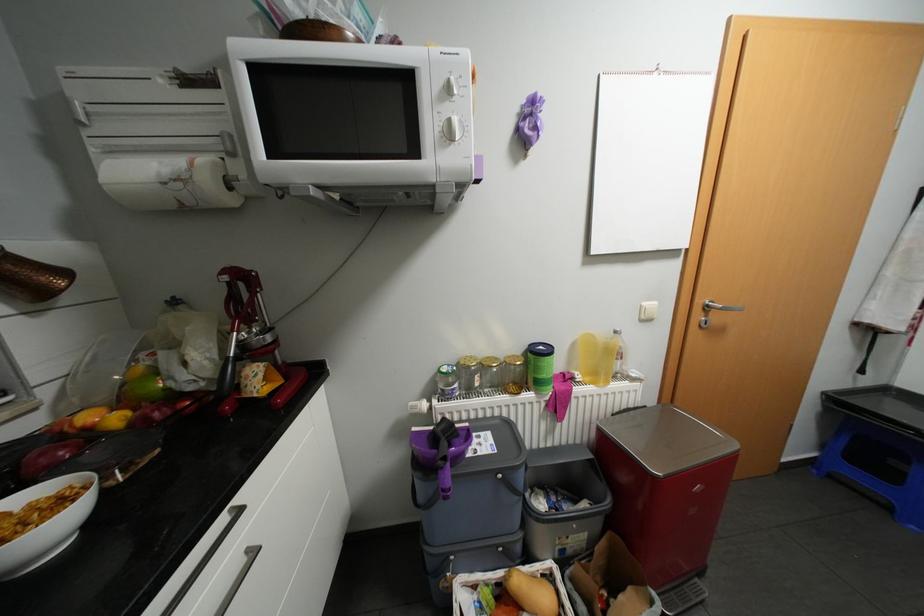
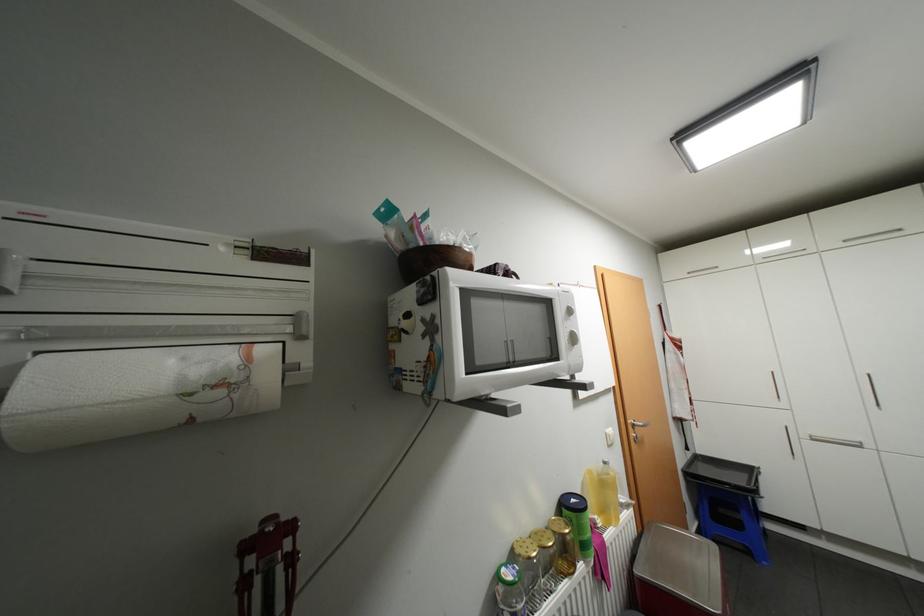
Find the pixel in the second image that matches pixel 452 369 in the first image.

(518, 576)